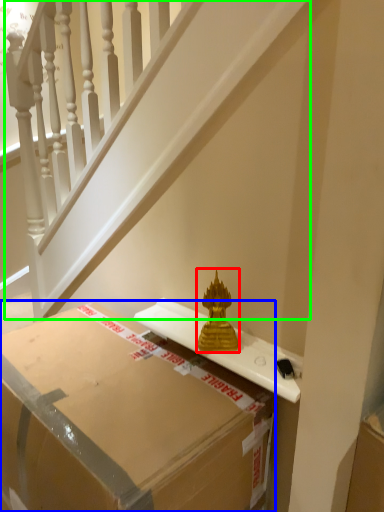
Question: Based on their relative distances, which object is farther from sculpture (highlighted by a red box)? Choose from box (highlighted by a blue box) and stairwell (highlighted by a green box).

Choices:
 (A) box
 (B) stairwell

Answer: (B)